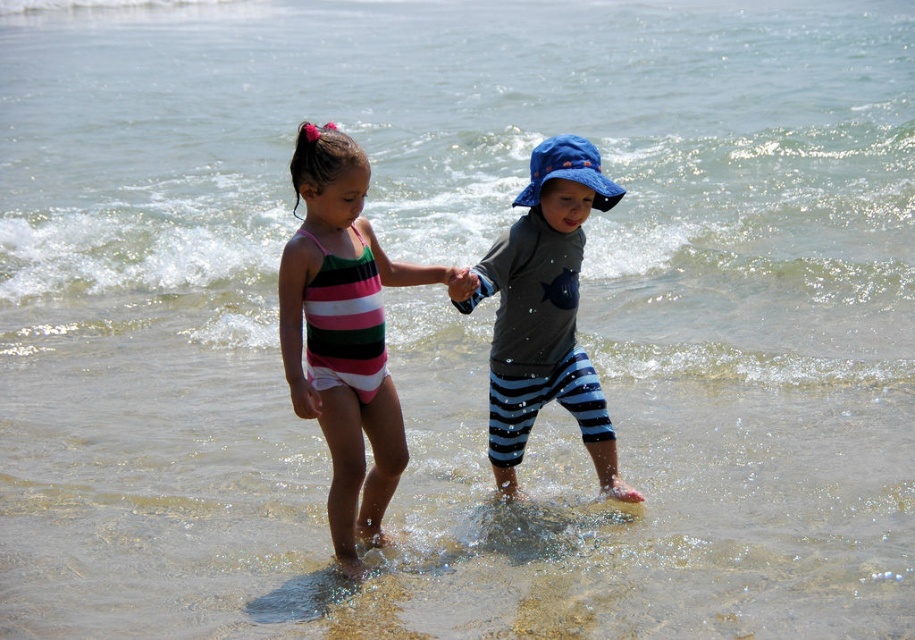
Describe the element at coordinates (343, 332) in the screenshot. I see `striped fabric swimsuit at center` at that location.

Does striped fabric swimsuit at center have a lesser height compared to blue cotton hat at center?

In fact, striped fabric swimsuit at center may be taller than blue cotton hat at center.

Between point (367, 513) and point (526, 433), which one is positioned in front?

Point (367, 513) is in front.

Image resolution: width=915 pixels, height=640 pixels. I want to click on striped fabric swimsuit at center, so click(x=343, y=332).

Who is higher up, blue cotton hat at center or smooth skin hand at center?

smooth skin hand at center is above.

This screenshot has height=640, width=915. Identify the location of blue cotton hat at center. (545, 312).

You are a GUI agent. You are given a task and a screenshot of the screen. Output one action in this format:
    pyautogui.click(x=<x>, y=<y>)
    Task: Click on the blue cotton hat at center
    Image resolution: width=915 pixels, height=640 pixels.
    Given the screenshot: What is the action you would take?
    pyautogui.click(x=545, y=312)

Between striped fabric swimsuit at center and smooth skin hand at center, which one appears on the left side from the viewer's perspective?

striped fabric swimsuit at center

Who is more distant from viewer, (x=331, y=294) or (x=455, y=268)?

Point (x=455, y=268)

You are a GUI agent. You are given a task and a screenshot of the screen. Output one action in this format:
    pyautogui.click(x=<x>, y=<y>)
    Task: Click on the striped fabric swimsuit at center
    This screenshot has width=915, height=640.
    Given the screenshot: What is the action you would take?
    pyautogui.click(x=343, y=332)